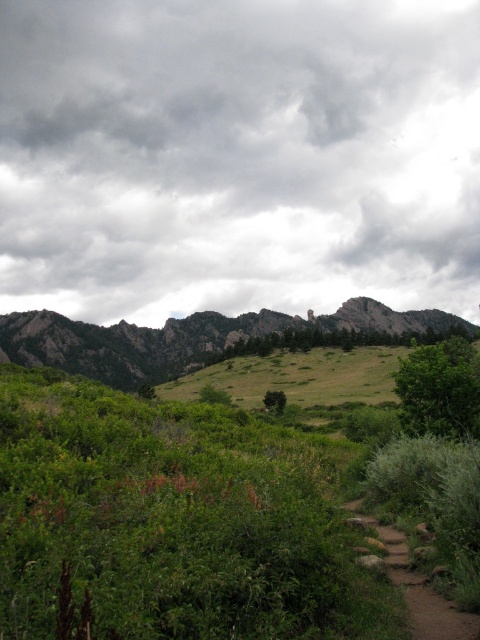
Is green leafy tree at center-right taller than brown dirt path at lower right?

Yes.

Which is below, green leafy tree at center-right or brown dirt path at lower right?

brown dirt path at lower right is below.

This screenshot has height=640, width=480. Identify the location of green leafy tree at center-right. (440, 388).

Is green grassy hill at center wider than green leafy tree at center-right?

Yes.

Does green grassy hill at center appear under green leafy tree at center-right?

Indeed, green grassy hill at center is positioned under green leafy tree at center-right.

Does point (165, 358) come in front of point (448, 435)?

No.

This screenshot has width=480, height=640. What are the coordinates of `green grassy hill at center` in the screenshot? It's located at (201, 339).

Who is more forward, (x=379, y=618) or (x=68, y=364)?

Point (x=379, y=618) is in front.

Who is lower down, green leafy shrubs at center or green grassy hill at center?

green leafy shrubs at center

Locate an element on the screen. The height and width of the screenshot is (640, 480). green leafy shrubs at center is located at coordinates (175, 522).